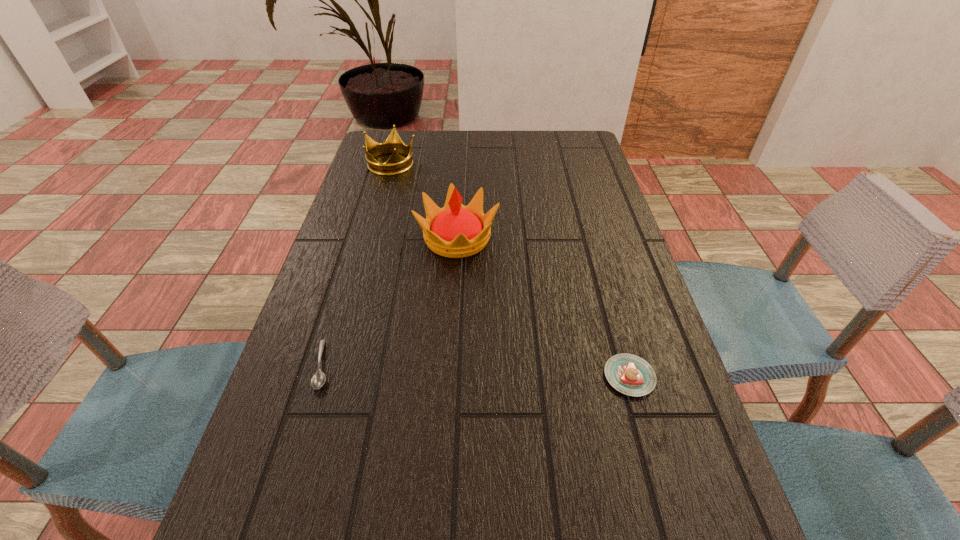
I want to click on vacant area situated 0.360m on the right of the shortest object, so click(523, 365).

I want to click on object present at the far edge, so click(396, 164).

You are a GUI agent. You are given a task and a screenshot of the screen. Output one action in this format:
    pyautogui.click(x=<x>, y=<y>)
    Task: Click on the crown located at the left edge
    
    Given the screenshot: What is the action you would take?
    pyautogui.click(x=396, y=164)

Identify the location of soupspoon situated at the left edge. Image resolution: width=960 pixels, height=540 pixels. coord(318,379).

You are a GUI agent. You are given a task and a screenshot of the screen. Output one action in this format:
    pyautogui.click(x=<x>, y=<y>)
    Task: Click on the object located at the right edge
    The height and width of the screenshot is (540, 960).
    Given the screenshot: What is the action you would take?
    pyautogui.click(x=629, y=374)

What are the coordinates of `object at the far left corner` in the screenshot? It's located at (396, 164).

Where is `vacant space at the far edge of the desktop`? vacant space at the far edge of the desktop is located at coordinates (465, 164).

In order to click on vacant space at the left edge of the desktop in this screenshot , I will do click(348, 251).

Where is `vacant space at the right edge of the desktop`? This screenshot has height=540, width=960. vacant space at the right edge of the desktop is located at coordinates (660, 400).

In the image, there is a desktop. Where is `blank space at the far right corner`? blank space at the far right corner is located at coordinates (579, 167).